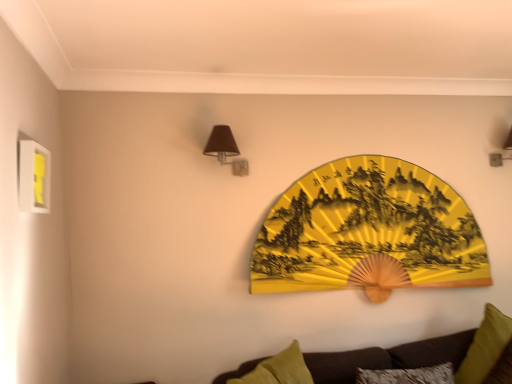
Question: Is matte brown wall sconce at upper right, which is the first lamp in back-to-front order, taller than dark brown fabric couch at lower right?

Choices:
 (A) no
 (B) yes

Answer: (A)

Question: Does matte brown wall sconce at upper right, which is the 2th lamp in left-to-right order, appear on the right side of dark brown fabric couch at lower right?

Choices:
 (A) yes
 (B) no

Answer: (A)

Question: From the image's perspective, would you say matte brown wall sconce at upper right, which is the first lamp in back-to-front order, is shown under dark brown fabric couch at lower right?

Choices:
 (A) no
 (B) yes

Answer: (A)

Question: Considering the relative sizes of matte brown wall sconce at upper right, marked as the second lamp in a front-to-back arrangement, and dark brown fabric couch at lower right in the image provided, is matte brown wall sconce at upper right, marked as the second lamp in a front-to-back arrangement, smaller than dark brown fabric couch at lower right?

Choices:
 (A) no
 (B) yes

Answer: (B)

Question: Is dark brown fabric couch at lower right a part of matte brown wall sconce at upper right, marked as the second lamp in a front-to-back arrangement?

Choices:
 (A) yes
 (B) no

Answer: (B)

Question: In terms of size, does yellow matte picture frame at upper left appear bigger or smaller than green fabric pillow at lower right?

Choices:
 (A) small
 (B) big

Answer: (A)

Question: Is yellow matte picture frame at upper left taller or shorter than green fabric pillow at lower right?

Choices:
 (A) tall
 (B) short

Answer: (B)

Question: Is yellow matte picture frame at upper left in front of or behind green fabric pillow at lower right in the image?

Choices:
 (A) behind
 (B) front

Answer: (B)

Question: In the image, is yellow matte picture frame at upper left on the left side or the right side of green fabric pillow at lower right?

Choices:
 (A) right
 (B) left

Answer: (B)

Question: Is matte brown wall sconce at upper right, marked as the second lamp in a front-to-back arrangement, in front of or behind yellow matte picture frame at upper left in the image?

Choices:
 (A) behind
 (B) front

Answer: (A)

Question: Which is correct: matte brown wall sconce at upper right, the 1th lamp in the right-to-left sequence, is inside yellow matte picture frame at upper left, or outside of it?

Choices:
 (A) inside
 (B) outside

Answer: (B)

Question: Is point (500, 157) positioned closer to the camera than point (41, 188)?

Choices:
 (A) closer
 (B) farther

Answer: (B)

Question: From a real-world perspective, relative to yellow matte picture frame at upper left, is matte brown wall sconce at upper right, the 1th lamp in the right-to-left sequence, vertically above or below?

Choices:
 (A) above
 (B) below

Answer: (A)

Question: Which is correct: green fabric pillow at lower right is inside dark brown fabric couch at lower right, or outside of it?

Choices:
 (A) inside
 (B) outside

Answer: (A)

Question: Is point (475, 359) closer or farther from the camera than point (333, 355)?

Choices:
 (A) closer
 (B) farther

Answer: (B)